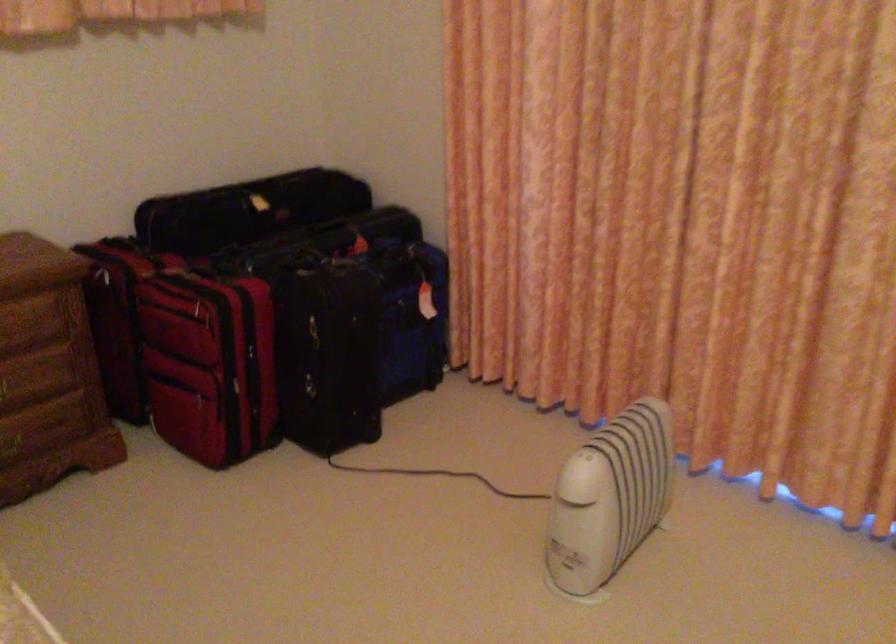
What do you see at coordinates (247, 210) in the screenshot? I see `the black case handle` at bounding box center [247, 210].